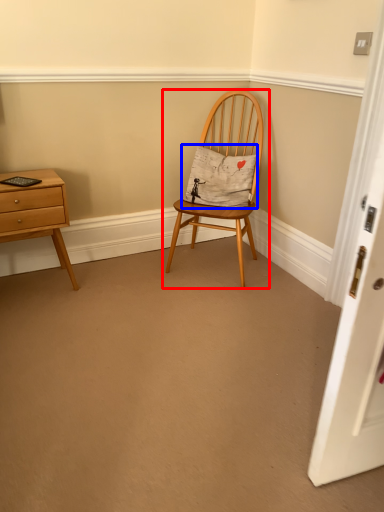
Question: Which object is further to the camera taking this photo, chair (highlighted by a red box) or pillow (highlighted by a blue box)?

Choices:
 (A) chair
 (B) pillow

Answer: (B)